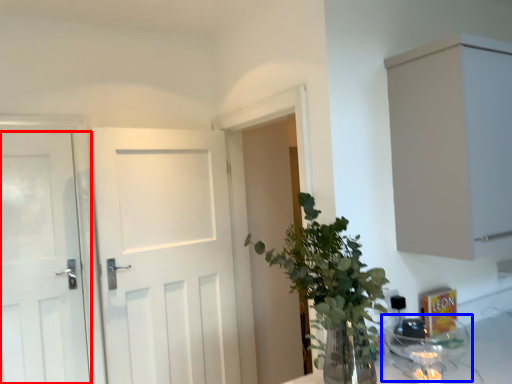
Question: Which point is further to the camera, door (highlighted by a red box) or glass jar (highlighted by a blue box)?

Choices:
 (A) door
 (B) glass jar

Answer: (A)